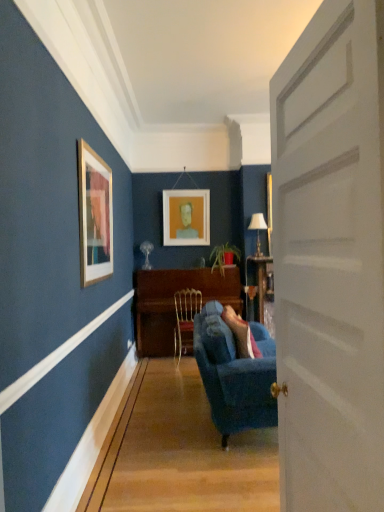
Question: From the image's perspective, is white matte picture frame at center located above or below metallic gold chair at center?

Choices:
 (A) below
 (B) above

Answer: (B)

Question: Is white matte picture frame at center taller or shorter than metallic gold chair at center?

Choices:
 (A) short
 (B) tall

Answer: (B)

Question: Which of these objects is positioned closest to the metallic gold chair at center?

Choices:
 (A) wooden piano at center
 (B) velvet blue couch at center
 (C) velvet blue couch at center
 (D) white matte door at center
 (E) white matte picture frame at center

Answer: (A)

Question: Estimate the real-world distances between objects in this image. Which object is farther from the white matte door at center?

Choices:
 (A) wooden piano at center
 (B) white matte picture frame at center
 (C) metallic gold chair at center
 (D) velvet blue couch at center
 (E) velvet blue couch at center

Answer: (B)